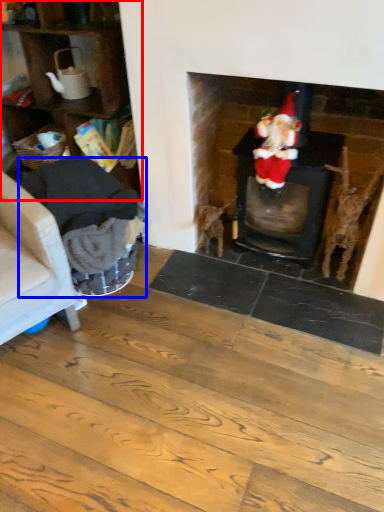
Question: Which object is closer to the camera taking this photo, shelf (highlighted by a red box) or armchair (highlighted by a blue box)?

Choices:
 (A) shelf
 (B) armchair

Answer: (B)